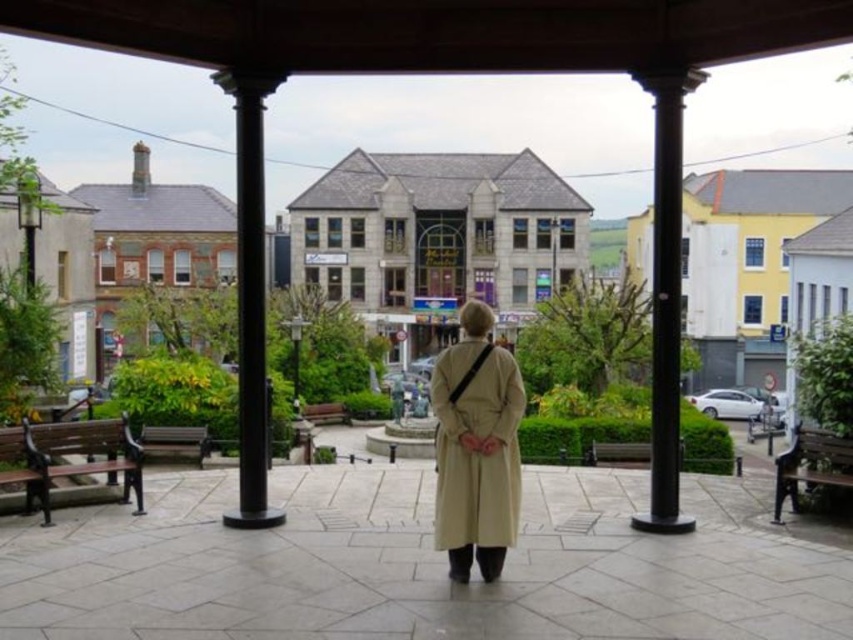
You are a person standing on the walkway and want to sit down. There are two wooden benches available. Which one is higher up, the wooden bench at right or the wooden bench at center?

The wooden bench at right is located above the wooden bench at center, so it is higher up.

You are standing under the covered walkway and want to walk towards the plaza. Which object, the black polished column at left or the metallic gray lamp post at center, should you pass first?

The black polished column at left is positioned on the left side of the metallic gray lamp post at center, so you should pass the black polished column at left first before reaching the metallic gray lamp post at center.